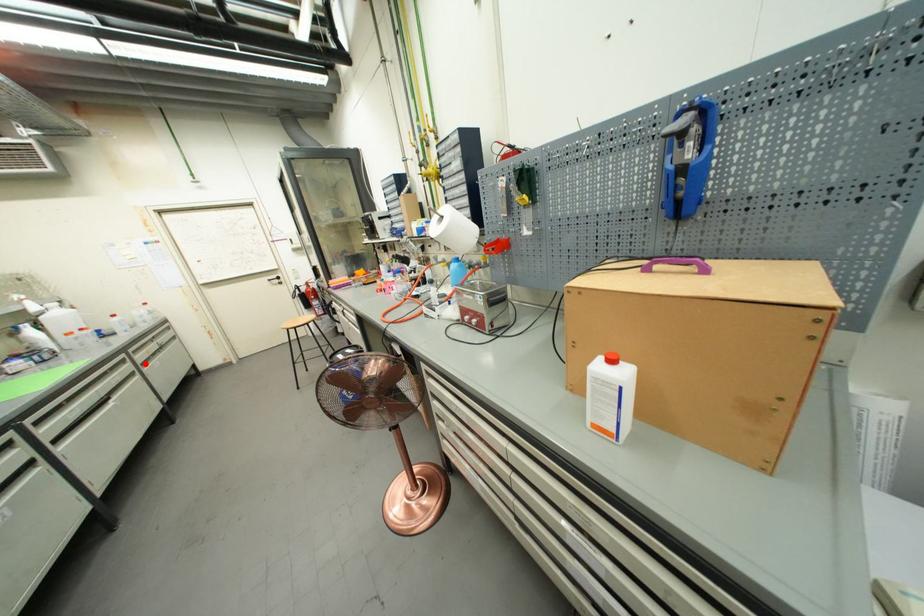
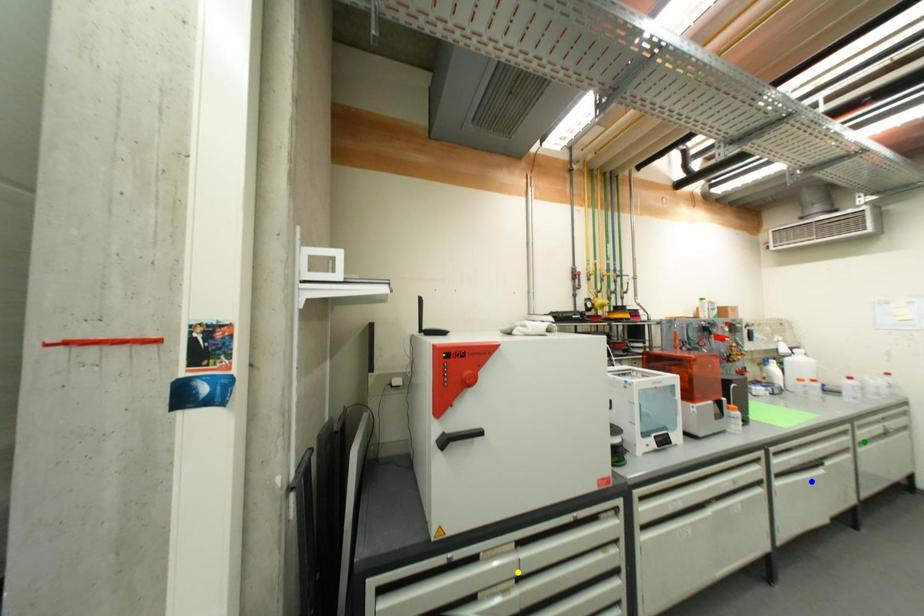
Question: I am providing you with two images of the same scene from different viewpoints. A red point is marked on the first image. You are given multiple points on the second image. In image 2, which mark is for the same physical point as the one in image 1?

Choices:
 (A) green point
 (B) yellow point
 (C) blue point

Answer: (A)